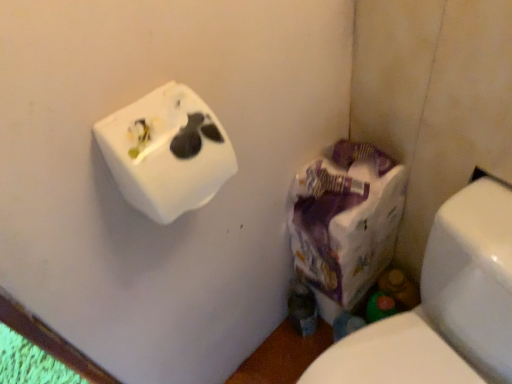
Question: From a real-world perspective, is white matte tissue box at upper left on white glossy toilet at lower right?

Choices:
 (A) yes
 (B) no

Answer: (A)

Question: Can white glossy toilet at lower right be found inside white matte tissue box at upper left?

Choices:
 (A) no
 (B) yes

Answer: (A)

Question: Can you confirm if white matte tissue box at upper left is thinner than white glossy toilet at lower right?

Choices:
 (A) yes
 (B) no

Answer: (A)

Question: Is the depth of white matte tissue box at upper left less than that of white glossy toilet at lower right?

Choices:
 (A) yes
 (B) no

Answer: (B)

Question: Is white matte tissue box at upper left wider than white glossy toilet at lower right?

Choices:
 (A) yes
 (B) no

Answer: (B)

Question: Is white matte tissue box at upper left in front of or behind white glossy toilet at lower right in the image?

Choices:
 (A) behind
 (B) front

Answer: (A)

Question: Is point (142, 201) positioned closer to the camera than point (484, 213)?

Choices:
 (A) farther
 (B) closer

Answer: (B)

Question: Considering the positions of white matte tissue box at upper left and white glossy toilet at lower right in the image, is white matte tissue box at upper left wider or thinner than white glossy toilet at lower right?

Choices:
 (A) wide
 (B) thin

Answer: (B)

Question: From the image's perspective, is white matte tissue box at upper left above or below white glossy toilet at lower right?

Choices:
 (A) below
 (B) above

Answer: (B)

Question: From the image's perspective, is purple paper bag at lower right positioned above or below white matte tissue box at upper left?

Choices:
 (A) above
 (B) below

Answer: (B)

Question: Is purple paper bag at lower right situated inside white matte tissue box at upper left or outside?

Choices:
 (A) outside
 (B) inside

Answer: (A)

Question: Visually, is purple paper bag at lower right positioned to the left or to the right of white matte tissue box at upper left?

Choices:
 (A) left
 (B) right

Answer: (B)

Question: Considering their positions, is purple paper bag at lower right located in front of or behind white matte tissue box at upper left?

Choices:
 (A) front
 (B) behind

Answer: (B)

Question: Looking at their shapes, would you say white glossy toilet at lower right is wider or thinner than purple paper bag at lower right?

Choices:
 (A) thin
 (B) wide

Answer: (B)

Question: Looking at the image, does white glossy toilet at lower right seem bigger or smaller compared to purple paper bag at lower right?

Choices:
 (A) small
 (B) big

Answer: (B)